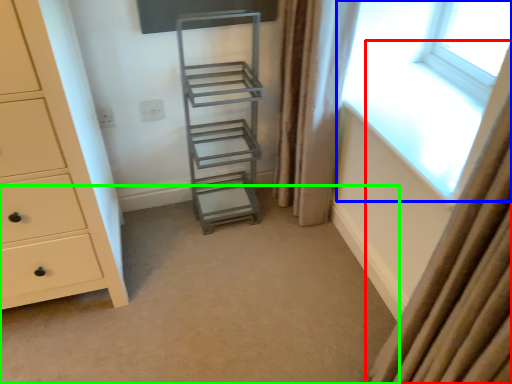
Question: Which object is the farthest from curtain (highlighted by a red box)? Choose among these: window (highlighted by a blue box) or plain (highlighted by a green box).

Choices:
 (A) window
 (B) plain

Answer: (A)